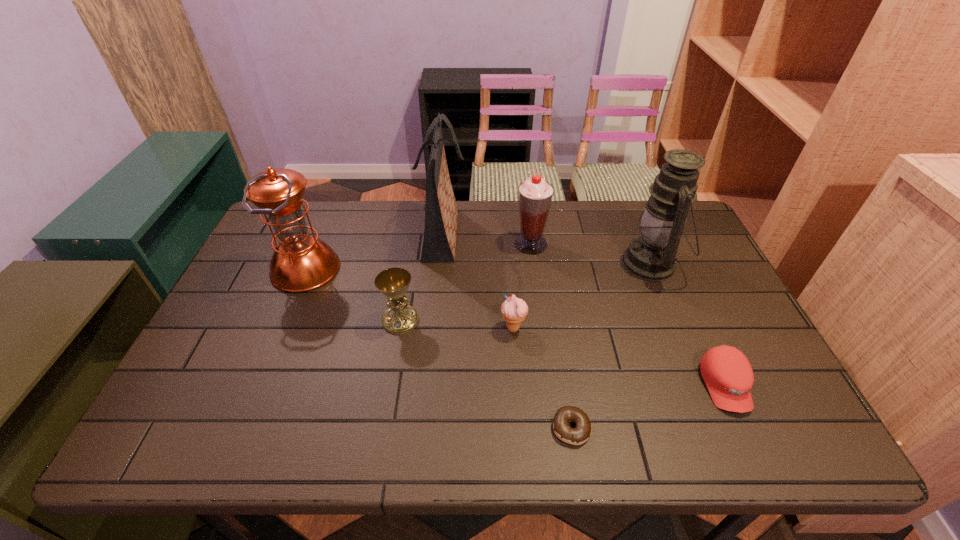
This screenshot has width=960, height=540. I want to click on shopping bag, so click(439, 243).

What are the coordinates of `the right oil lamp` in the screenshot? It's located at (652, 256).

Identify the location of the leftmost object. (301, 262).

In order to click on the fourth tallest object in this screenshot , I will do `click(535, 195)`.

Locate an element on the screen. The height and width of the screenshot is (540, 960). chalice is located at coordinates (393, 283).

Image resolution: width=960 pixels, height=540 pixels. Identify the location of the third shortest object. (514, 310).

Where is `the second shortest object`? The image size is (960, 540). the second shortest object is located at coordinates click(x=728, y=375).

Locate an element on the screen. The height and width of the screenshot is (540, 960). the shortest object is located at coordinates (580, 434).

Where is `vacant region located on the front-facing side of the shopping bag`? The height and width of the screenshot is (540, 960). vacant region located on the front-facing side of the shopping bag is located at coordinates (502, 234).

Image resolution: width=960 pixels, height=540 pixels. I want to click on free region located on the left of the right oil lamp, so click(596, 264).